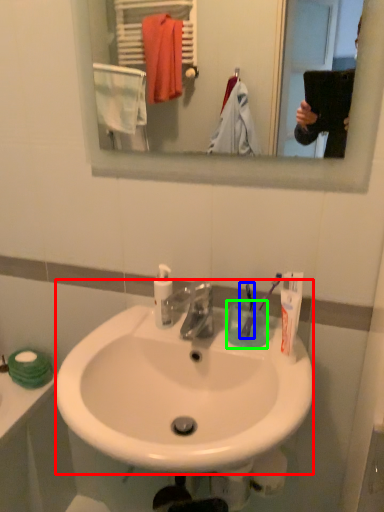
Question: Considering the real-world distances, which object is farthest from sink (highlighted by a red box)? toothbrush (highlighted by a blue box) or coffee cup (highlighted by a green box)?

Choices:
 (A) toothbrush
 (B) coffee cup

Answer: (A)